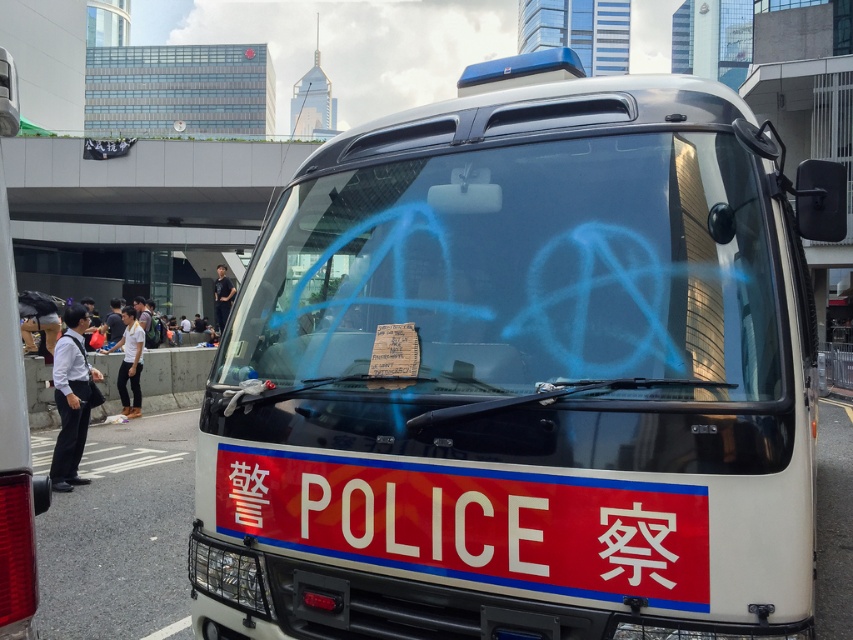
Question: Which point appears closest to the camera in this image?

Choices:
 (A) (637, 76)
 (B) (679, 212)

Answer: (B)

Question: Does white glossy police van at center appear on the left side of transparent glass windshield at center?

Choices:
 (A) no
 (B) yes

Answer: (A)

Question: Which point appears closest to the camera in this image?

Choices:
 (A) pos(596,394)
 (B) pos(451,248)

Answer: (A)

Question: From the image, what is the correct spatial relationship of white glossy police van at center in relation to transparent glass windshield at center?

Choices:
 (A) above
 (B) below

Answer: (B)

Question: Is white glossy police van at center below transparent glass windshield at center?

Choices:
 (A) no
 (B) yes

Answer: (B)